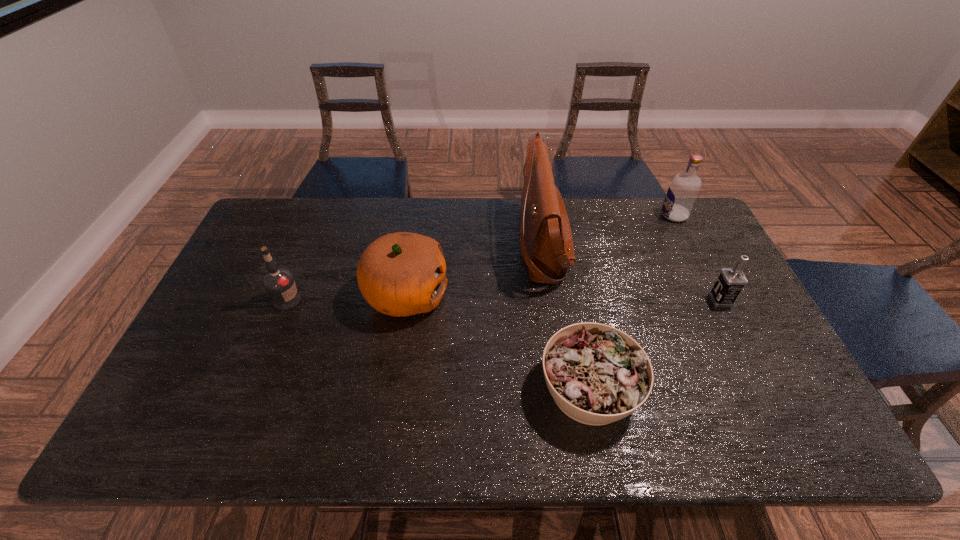
Find the location of `vodka at the far edge`. vodka at the far edge is located at coordinates pyautogui.click(x=683, y=190).

I want to click on object that is at the near edge, so click(597, 374).

Where is `object located at the far right corner`? object located at the far right corner is located at coordinates (683, 190).

Where is `free space at the far edge of the desktop`? The height and width of the screenshot is (540, 960). free space at the far edge of the desktop is located at coordinates (603, 207).

The width and height of the screenshot is (960, 540). Identify the location of vacant space at the left edge. (188, 371).

In the image, there is a desktop. Find the location of `vacant region at the right edge`. vacant region at the right edge is located at coordinates (697, 309).

This screenshot has width=960, height=540. In order to click on free space between the leftmost object and the farthest vodka in this screenshot , I will do `click(481, 258)`.

Locate an element on the screen. This screenshot has height=540, width=960. free space that is in between the farthest vodka and the second shortest object is located at coordinates (697, 258).

You are a GUI agent. You are given a task and a screenshot of the screen. Output one action in this format:
    pyautogui.click(x=<x>, y=<y>)
    Task: Click on the empty location between the farthest vodka and the leftmost object
    
    Given the screenshot: What is the action you would take?
    pyautogui.click(x=481, y=258)

Locate an element on the screen. The image size is (960, 540). unoccupied area between the leftmost vodka and the shortest object is located at coordinates (439, 345).